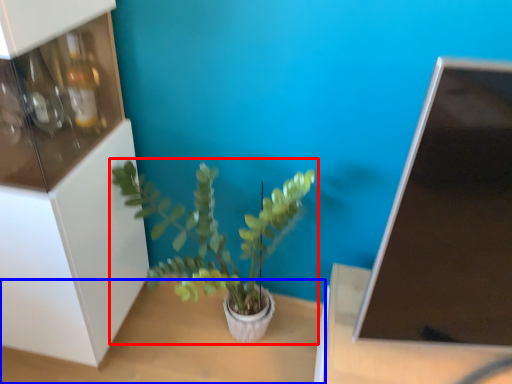
Question: Which object appears farthest to the camera in this image, houseplant (highlighted by a red box) or table (highlighted by a blue box)?

Choices:
 (A) houseplant
 (B) table

Answer: (B)